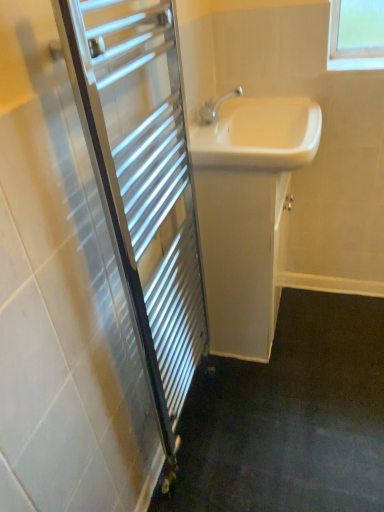
Question: Considering the positions of white glossy sink at center and chrome metallic towel rack at left in the image, is white glossy sink at center taller or shorter than chrome metallic towel rack at left?

Choices:
 (A) short
 (B) tall

Answer: (A)

Question: From the image's perspective, relative to chrome metallic towel rack at left, is white glossy sink at center above or below?

Choices:
 (A) above
 (B) below

Answer: (A)

Question: Which object is the farthest from the white glossy cabinet at center?

Choices:
 (A) white glossy sink at center
 (B) chrome metallic towel rack at left

Answer: (B)

Question: Which is nearer to the white glossy cabinet at center?

Choices:
 (A) chrome metallic towel rack at left
 (B) white glossy sink at center

Answer: (B)